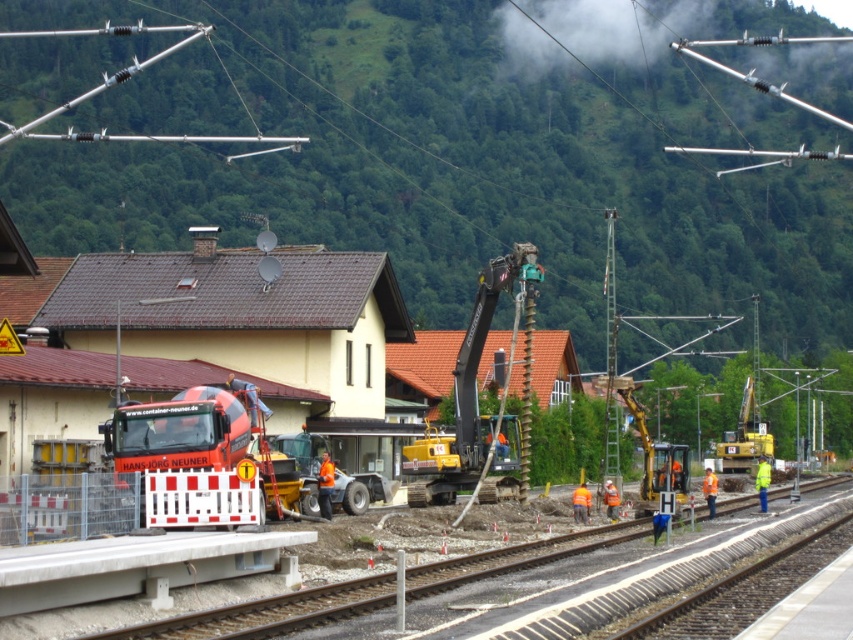
You are a construction supervisor observing the railway construction site. You need to determine which excavator is taller between the teal metallic excavator at center and the metallic yellow excavator at center. Based on the scene, which one is taller?

The teal metallic excavator at center is taller than the metallic yellow excavator at center according to the description.

You are a construction supervisor who needs to determine which excavator can fit through a narrow passage that is 3 meters wide. The passage is located between two construction zones. Based on the image, which excavator between the teal metallic excavator at center and the metallic yellow excavator at center is more likely to fit through the passage?

The teal metallic excavator at center has a width less than the metallic yellow excavator at center, so it is more likely to fit through the 3 meter wide passage.